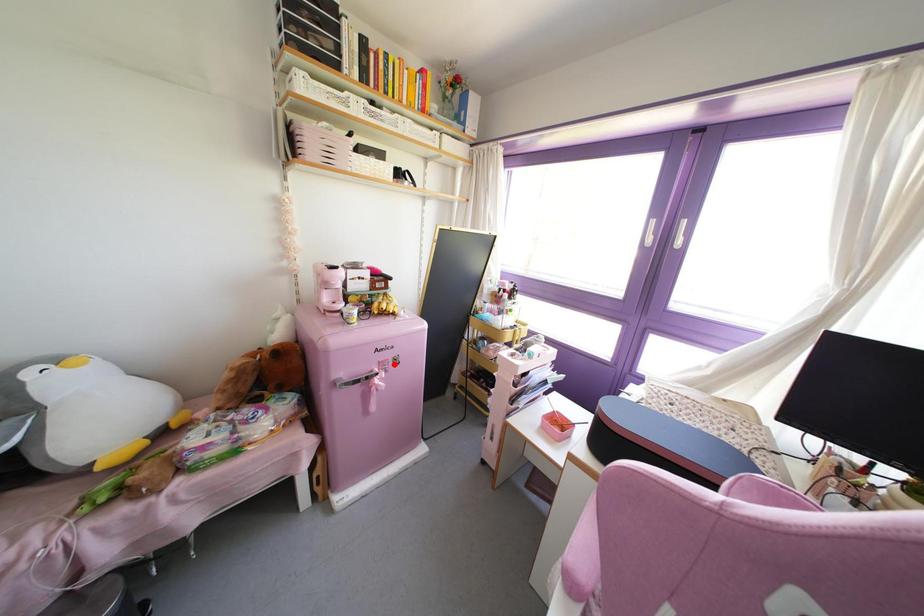
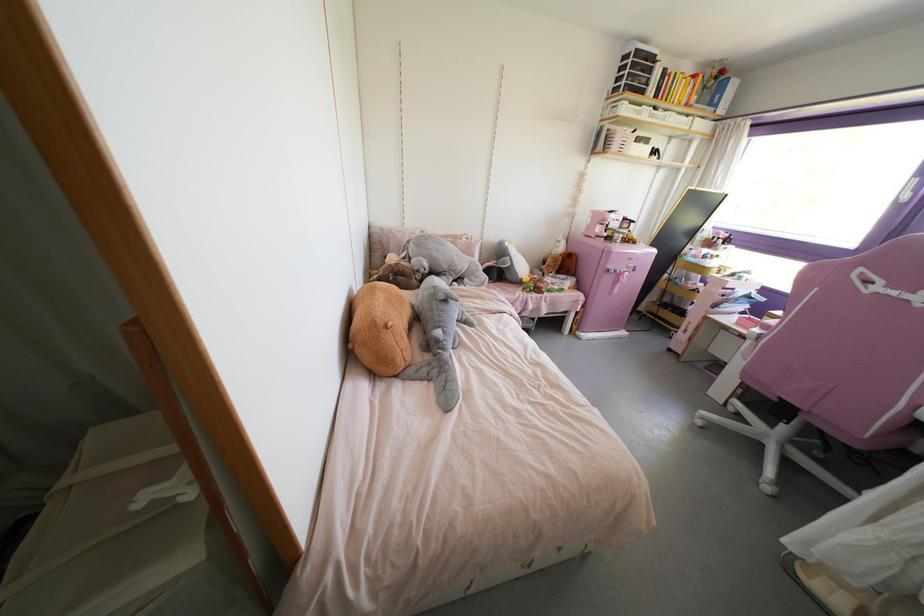
Question: I am providing you with two images of the same scene from different viewpoints. A red point is shown in image1. For the corresponding object point in image2, is it positioned nearer or farther from the camera?

Choices:
 (A) Nearer
 (B) Farther

Answer: (A)